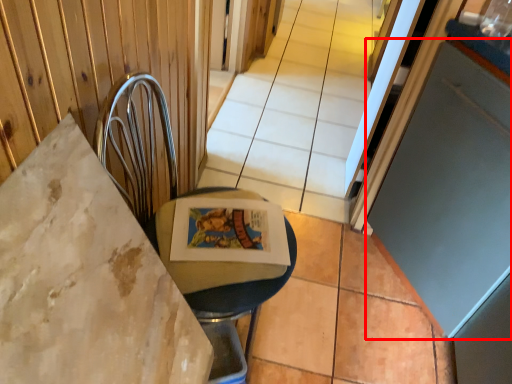
Question: From the image's perspective, what is the correct spatial relationship of screen door (annotated by the red box) in relation to swivel chair?

Choices:
 (A) above
 (B) below

Answer: (A)